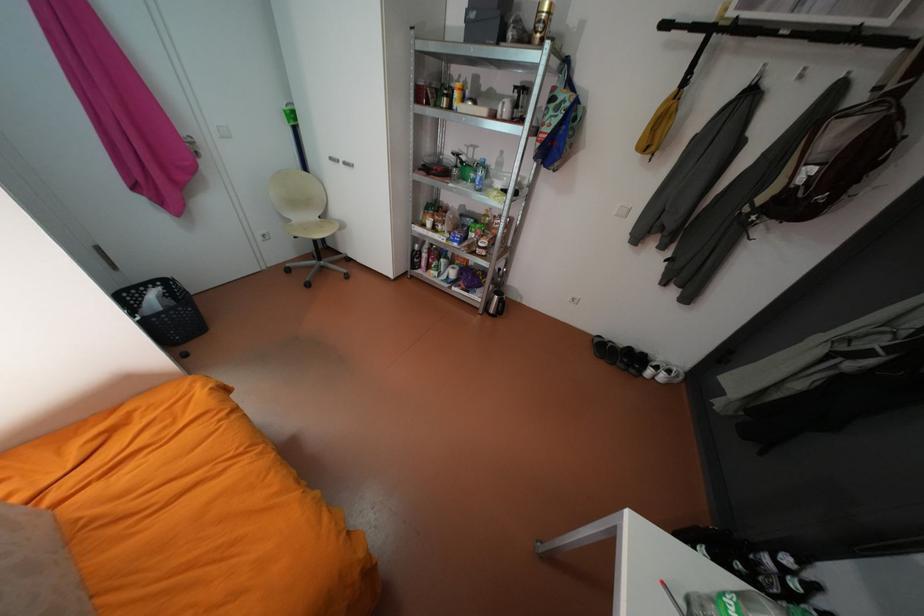
Find where to lift the black electric kettle. Please return your answer as a coordinate pair (x, y).

(494, 302)